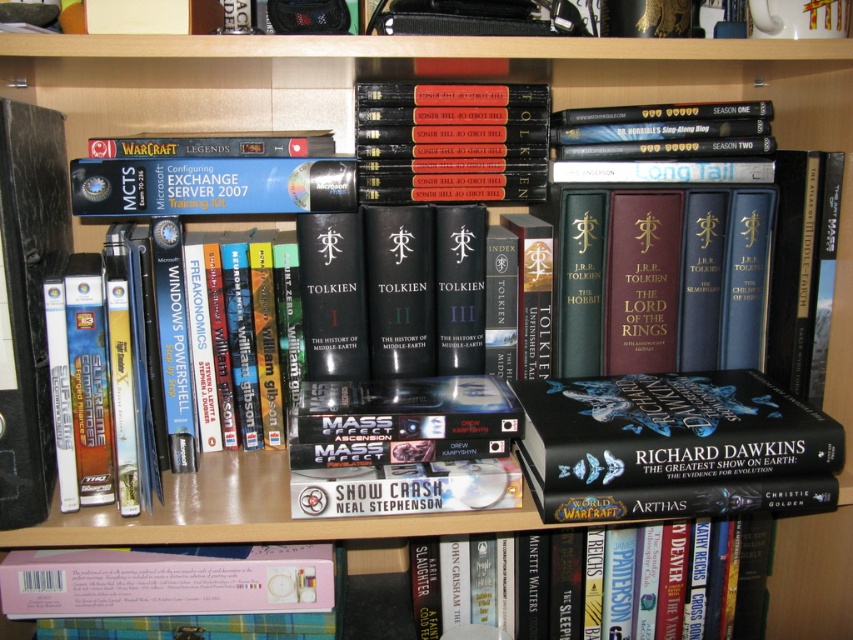
Question: Which object is farther from the camera taking this photo?

Choices:
 (A) hardcover book at center
 (B) pink matte book at lower left

Answer: (A)

Question: Does pink matte book at lower left have a larger size compared to hardcover book at center?

Choices:
 (A) no
 (B) yes

Answer: (A)

Question: Can you confirm if pink matte book at lower left is thinner than hardcover book at center?

Choices:
 (A) yes
 (B) no

Answer: (B)

Question: Does pink matte book at lower left have a smaller size compared to hardcover book at center?

Choices:
 (A) no
 (B) yes

Answer: (B)

Question: Which point is farther to the camera?

Choices:
 (A) (53, 598)
 (B) (727, 548)

Answer: (B)